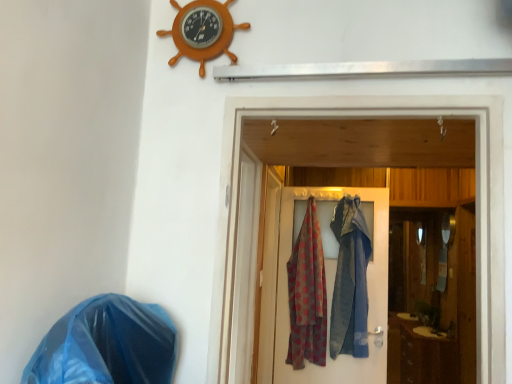
Question: Can you confirm if polka dot fabric at center is shorter than blue plastic bag at lower left?

Choices:
 (A) no
 (B) yes

Answer: (A)

Question: Is polka dot fabric at center far away from blue plastic bag at lower left?

Choices:
 (A) yes
 (B) no

Answer: (A)

Question: From the image's perspective, is polka dot fabric at center under blue plastic bag at lower left?

Choices:
 (A) no
 (B) yes

Answer: (B)

Question: Is polka dot fabric at center further to camera compared to blue plastic bag at lower left?

Choices:
 (A) yes
 (B) no

Answer: (A)

Question: Is polka dot fabric at center located outside blue plastic bag at lower left?

Choices:
 (A) yes
 (B) no

Answer: (A)

Question: Considering the positions of point (219, 362) and point (190, 1), is point (219, 362) closer or farther from the camera than point (190, 1)?

Choices:
 (A) farther
 (B) closer

Answer: (B)

Question: Is wooden door at center, the 1th door in the front-to-back sequence, bigger or smaller than orange wood ship wheel at upper center?

Choices:
 (A) small
 (B) big

Answer: (B)

Question: From the image's perspective, is wooden door at center, the 1th door in the front-to-back sequence, located above or below orange wood ship wheel at upper center?

Choices:
 (A) below
 (B) above

Answer: (A)

Question: Considering their positions, is wooden door at center, which is the 2th door in back-to-front order, located in front of or behind orange wood ship wheel at upper center?

Choices:
 (A) behind
 (B) front

Answer: (B)

Question: From the image's perspective, is wooden door at center, which is the 2th door in back-to-front order, positioned above or below polka dot fabric at center?

Choices:
 (A) below
 (B) above

Answer: (B)

Question: Which is correct: wooden door at center, which is the 2th door in back-to-front order, is inside polka dot fabric at center, or outside of it?

Choices:
 (A) inside
 (B) outside

Answer: (B)

Question: Considering the positions of wooden door at center, which is the 2th door in back-to-front order, and polka dot fabric at center in the image, is wooden door at center, which is the 2th door in back-to-front order, wider or thinner than polka dot fabric at center?

Choices:
 (A) wide
 (B) thin

Answer: (B)

Question: Based on their sizes in the image, would you say wooden door at center, which is the 2th door in back-to-front order, is bigger or smaller than polka dot fabric at center?

Choices:
 (A) big
 (B) small

Answer: (A)

Question: From the image's perspective, is polka dot fabric at center above or below wooden door at center, the 1th door in the front-to-back sequence?

Choices:
 (A) below
 (B) above

Answer: (A)

Question: Is polka dot fabric at center bigger or smaller than wooden door at center, which is the 2th door in back-to-front order?

Choices:
 (A) small
 (B) big

Answer: (A)